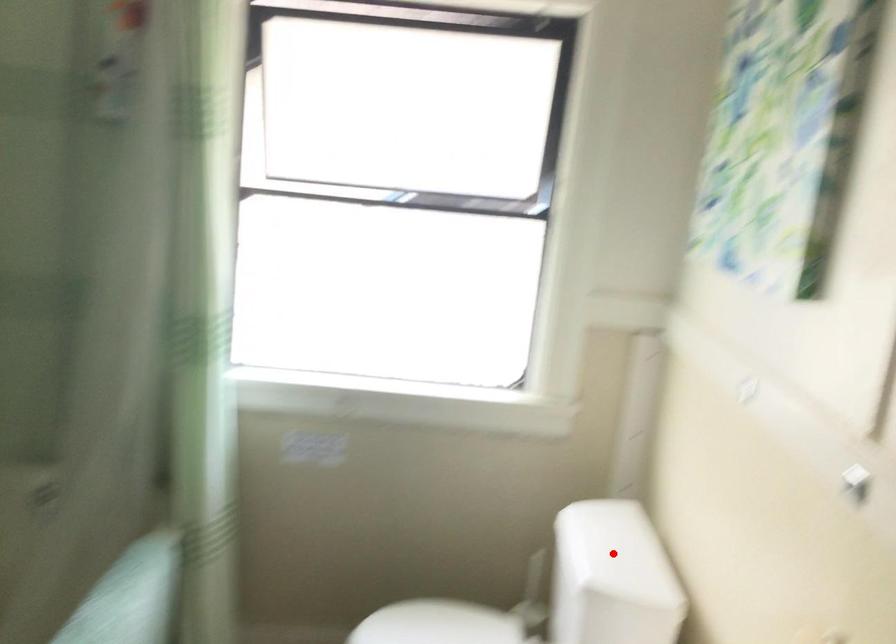
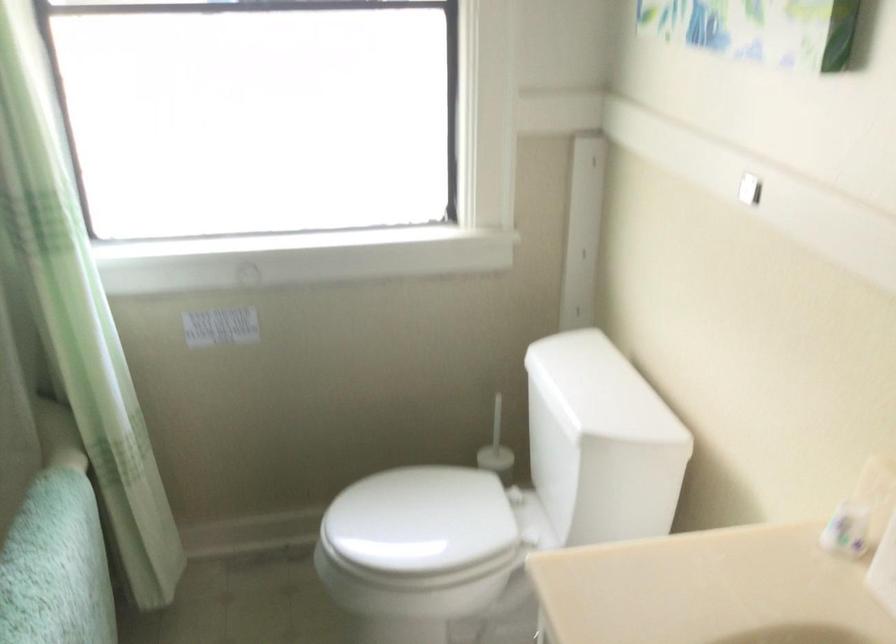
Locate, in the second image, the point that corresponds to the highlighted location in the first image.

(599, 390)